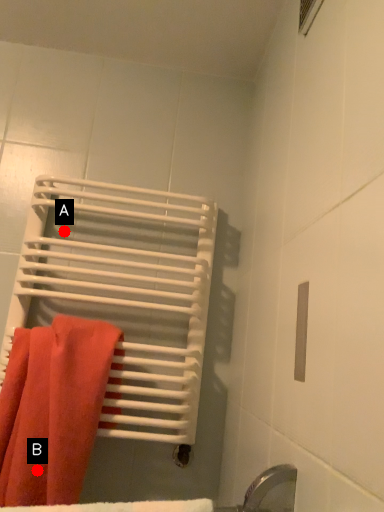
Question: Two points are circled on the image, labeled by A and B beside each circle. Among these points, which one is nearest to the camera?

Choices:
 (A) A is closer
 (B) B is closer

Answer: (B)